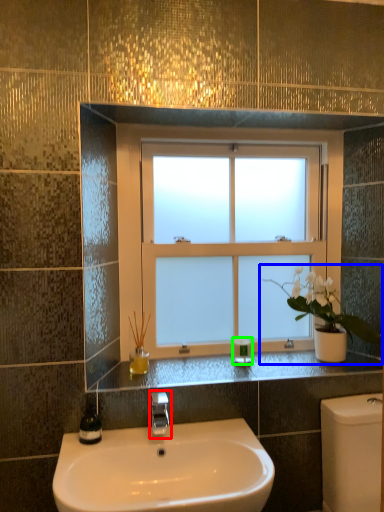
Question: Which object is the closest to the tap (highlighted by a red box)? Choose among these: houseplant (highlighted by a blue box) or toiletry (highlighted by a green box).

Choices:
 (A) houseplant
 (B) toiletry

Answer: (B)